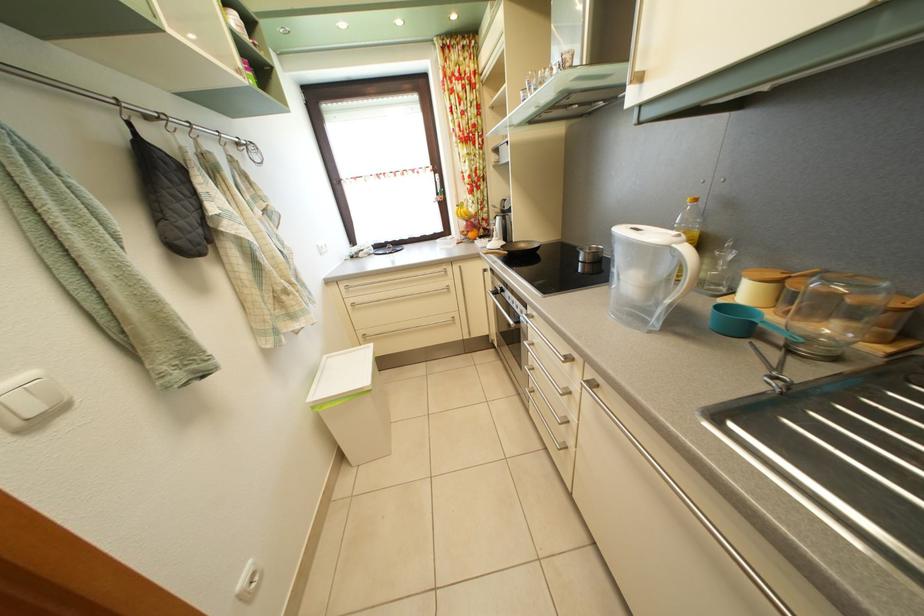
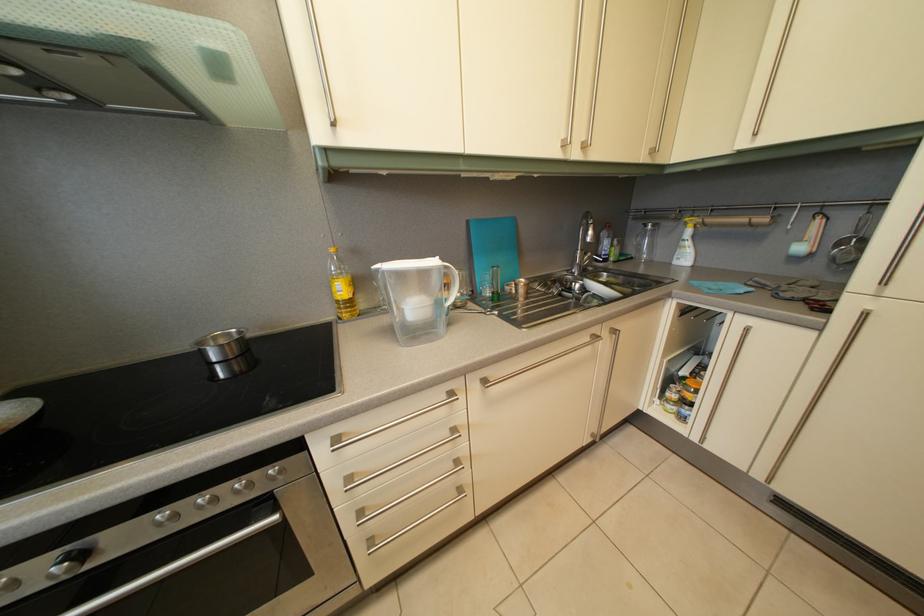
The point at (511, 298) is marked in the first image. Where is the corresponding point in the second image?

(92, 562)